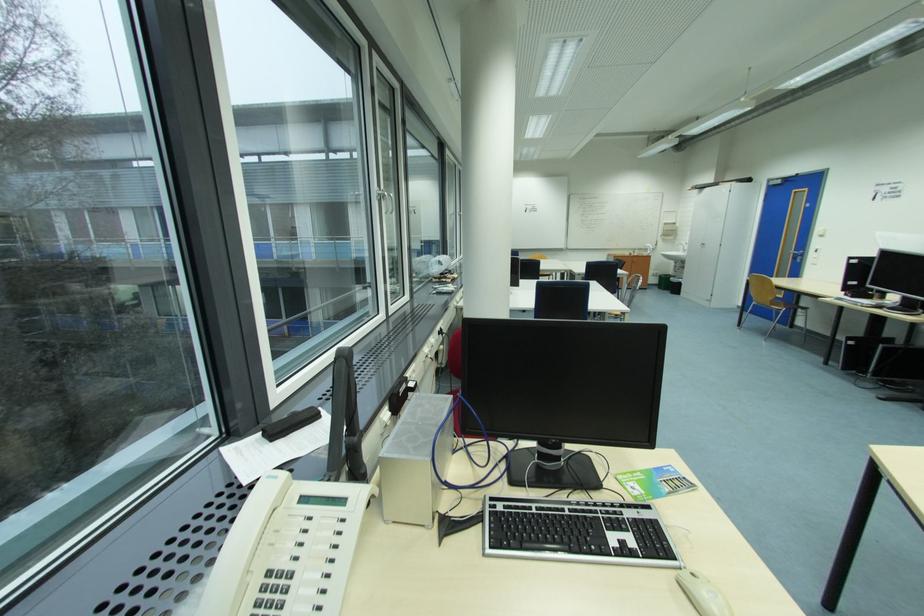
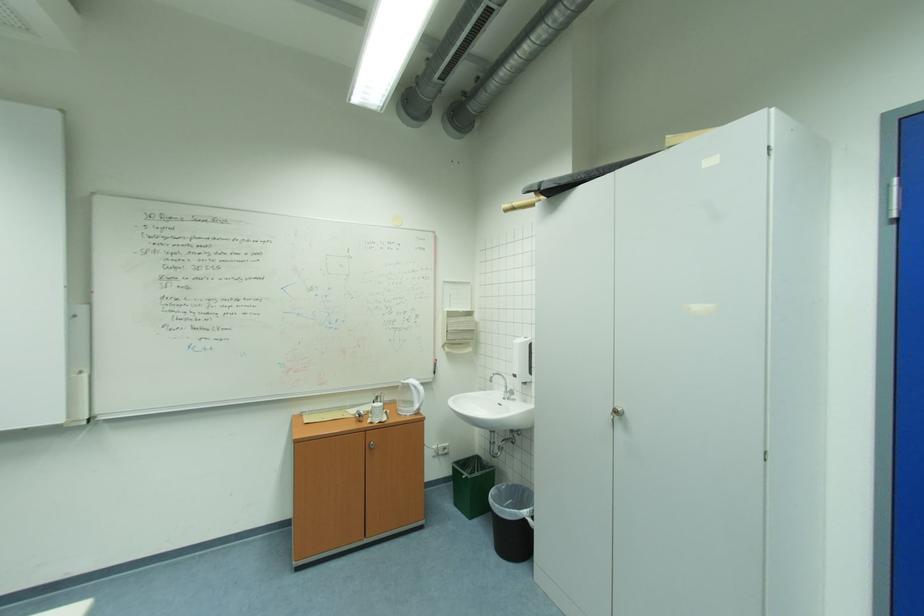
Find the pixel in the second image that matches point 687,281 in the first image.

(532, 513)